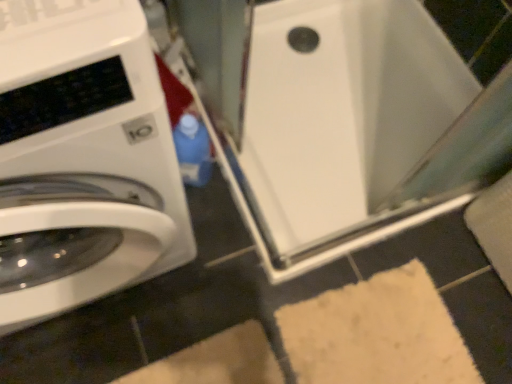
At what (x,y) coordinates should I click in order to perform the action: click on white glossy water heater at center. Please return your answer as a coordinate pair (x, y). Image resolution: width=512 pixels, height=384 pixels. Looking at the image, I should click on (337, 118).

What is the approximate height of white glossy water heater at center?

The height of white glossy water heater at center is 3.13 inches.

Measure the distance between white glossy water heater at center and camera.

The depth of white glossy water heater at center is 28.41 inches.

What do you see at coordinates (337, 118) in the screenshot? I see `white glossy water heater at center` at bounding box center [337, 118].

From the picture: Measure the distance between point (3, 3) and camera.

Point (3, 3) is 17.83 inches away from camera.

What do you see at coordinates (82, 158) in the screenshot? The image size is (512, 384). I see `white glossy washing machine at left` at bounding box center [82, 158].

Locate an element on the screen. The image size is (512, 384). white glossy washing machine at left is located at coordinates (82, 158).

In order to click on white glossy water heater at center in this screenshot , I will do `click(337, 118)`.

Is white glossy water heater at center to the left of white glossy washing machine at left from the viewer's perspective?

No.

Considering the relative positions of white glossy water heater at center and white glossy washing machine at left in the image provided, is white glossy water heater at center in front of white glossy washing machine at left?

No, it is behind white glossy washing machine at left.

Is point (344, 41) positioned after point (76, 283)?

Yes, it is.

From the picture: From the image's perspective, between white glossy water heater at center and white glossy washing machine at left, which one is located above?

From the image's view, white glossy water heater at center is above.

From a real-world perspective, who is located higher, white glossy water heater at center or white glossy washing machine at left?

white glossy washing machine at left.

Based on the photo, looking at their sizes, would you say white glossy water heater at center is wider or thinner than white glossy washing machine at left?

Clearly, white glossy water heater at center has more width compared to white glossy washing machine at left.

Is white glossy water heater at center taller or shorter than white glossy washing machine at left?

Considering their sizes, white glossy water heater at center has less height than white glossy washing machine at left.

Between white glossy water heater at center and white glossy washing machine at left, which one has larger size?

Bigger between the two is white glossy washing machine at left.

Is white glossy washing machine at left a part of white glossy water heater at center?

No, white glossy washing machine at left is not inside white glossy water heater at center.

Does white glossy water heater at center touch white glossy washing machine at left?

No, white glossy water heater at center is not with white glossy washing machine at left.

Consider the image. Is white glossy water heater at center oriented away from white glossy washing machine at left?

No, white glossy water heater at center's orientation is not away from white glossy washing machine at left.

Locate an element on the screen. water heater located underneath the white glossy washing machine at left (from a real-world perspective) is located at coordinates (337, 118).

Considering the relative positions of white glossy washing machine at left and white glossy water heater at center in the image provided, is white glossy washing machine at left to the left or to the right of white glossy water heater at center?

In the image, white glossy washing machine at left appears on the left side of white glossy water heater at center.

In the image, is white glossy washing machine at left positioned in front of or behind white glossy water heater at center?

Clearly, white glossy washing machine at left is in front of white glossy water heater at center.

Which is behind, point (16, 218) or point (293, 171)?

The point (293, 171) is more distant.

From the image's perspective, relative to white glossy water heater at center, is white glossy washing machine at left above or below?

Based on their image positions, white glossy washing machine at left is located beneath white glossy water heater at center.

From a real-world perspective, is white glossy washing machine at left below white glossy water heater at center?

No, from a real-world perspective, white glossy washing machine at left is not under white glossy water heater at center.

Can you confirm if white glossy washing machine at left is thinner than white glossy water heater at center?

Yes, white glossy washing machine at left is thinner than white glossy water heater at center.

Which of these two, white glossy washing machine at left or white glossy water heater at center, stands taller?

Standing taller between the two is white glossy washing machine at left.

Is white glossy washing machine at left bigger than white glossy water heater at center?

Yes.

Is white glossy washing machine at left completely or partially outside of white glossy water heater at center?

Yes.

Is white glossy washing machine at left positioned far away from white glossy water heater at center?

No, white glossy washing machine at left is in close proximity to white glossy water heater at center.

Is white glossy washing machine at left positioned with its back to white glossy water heater at center?

No, white glossy washing machine at left is not facing away from white glossy water heater at center.

What's the angular difference between white glossy washing machine at left and white glossy water heater at center's facing directions?

1.59 degrees separate the facing orientations of white glossy washing machine at left and white glossy water heater at center.

Where is `water heater behind the white glossy washing machine at left`? Image resolution: width=512 pixels, height=384 pixels. water heater behind the white glossy washing machine at left is located at coordinates (337, 118).

Find the location of `washing machine in front of the white glossy water heater at center`. washing machine in front of the white glossy water heater at center is located at coordinates pos(82,158).

You are a GUI agent. You are given a task and a screenshot of the screen. Output one action in this format:
    pyautogui.click(x=<x>, y=<y>)
    Task: Click on the water heater on the right of white glossy washing machine at left
    
    Given the screenshot: What is the action you would take?
    pyautogui.click(x=337, y=118)